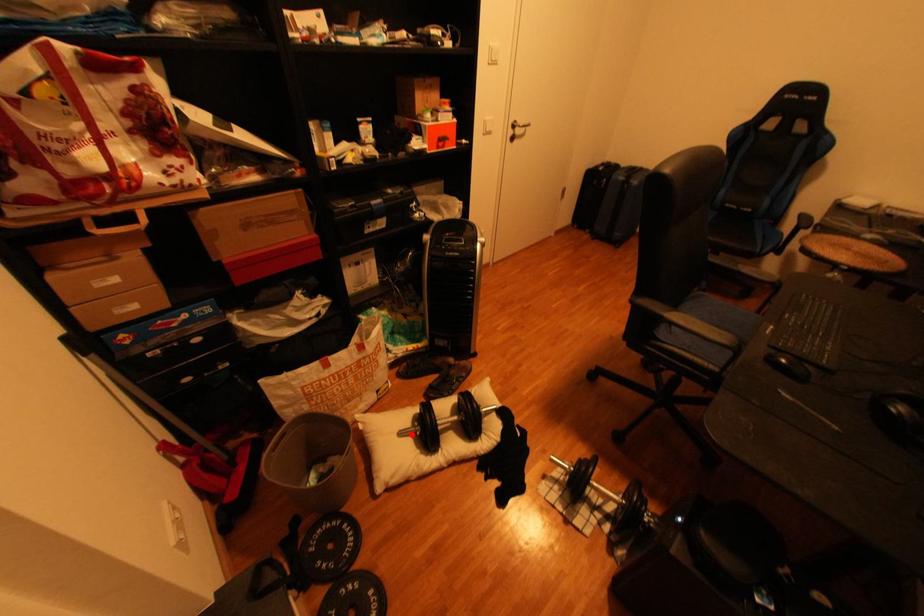
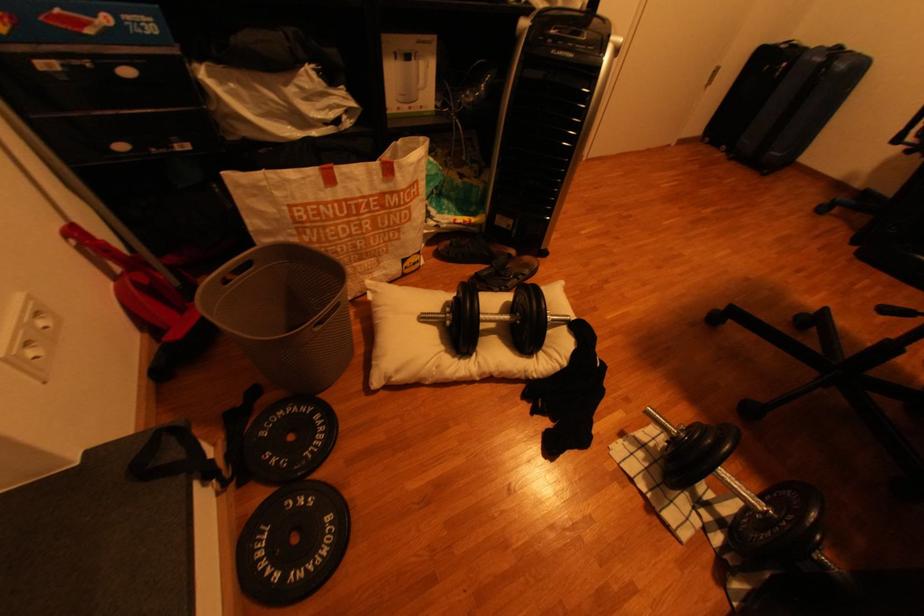
The point at the highlighted location is marked in the first image. Where is the corresponding point in the second image?

(433, 318)